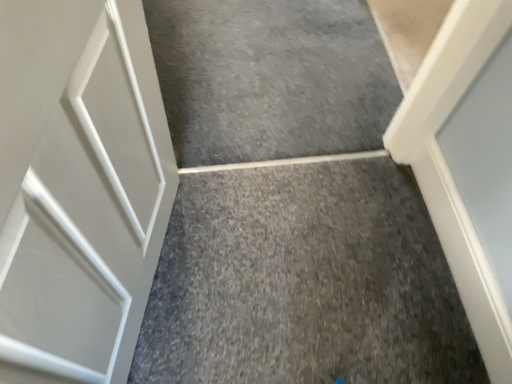
Locate an element on the screen. white matte door at left is located at coordinates (78, 187).

From the picture: Measure the distance between point (14,78) and camera.

Point (14,78) and camera are 17.40 inches apart from each other.

This screenshot has height=384, width=512. What do you see at coordinates (78, 187) in the screenshot?
I see `white matte door at left` at bounding box center [78, 187].

You are a GUI agent. You are given a task and a screenshot of the screen. Output one action in this format:
    pyautogui.click(x=<x>, y=<y>)
    Task: Click on the white matte door at left
    
    Given the screenshot: What is the action you would take?
    pyautogui.click(x=78, y=187)